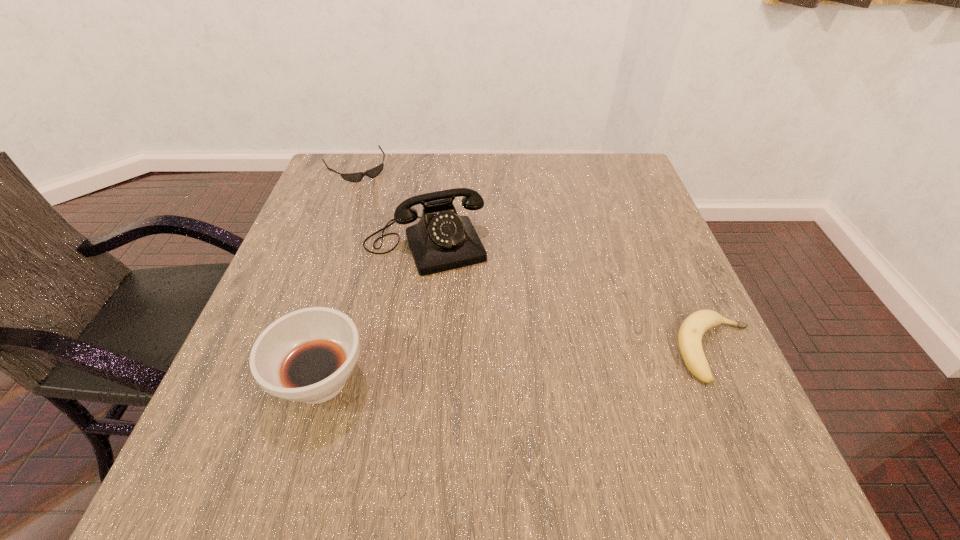
I want to click on object that is the third closest to the sunglasses, so click(x=692, y=329).

Choose which object is the second nearest neighbor to the second farthest object. Please provide its 2D coordinates. Your answer should be formatted as a tuple, i.e. [(x, y)], where the tuple contains the x and y coordinates of a point satisfying the conditions above.

[(307, 355)]

The image size is (960, 540). Identify the location of blank area in the image that satisfies the following two spatial constraints: 1. on the front side of the third shortest object; 2. on the left side of the shortest object. (276, 380).

Locate an element on the screen. This screenshot has height=540, width=960. free space that satisfies the following two spatial constraints: 1. on the front side of the telephone; 2. on the left side of the farthest object is located at coordinates (326, 245).